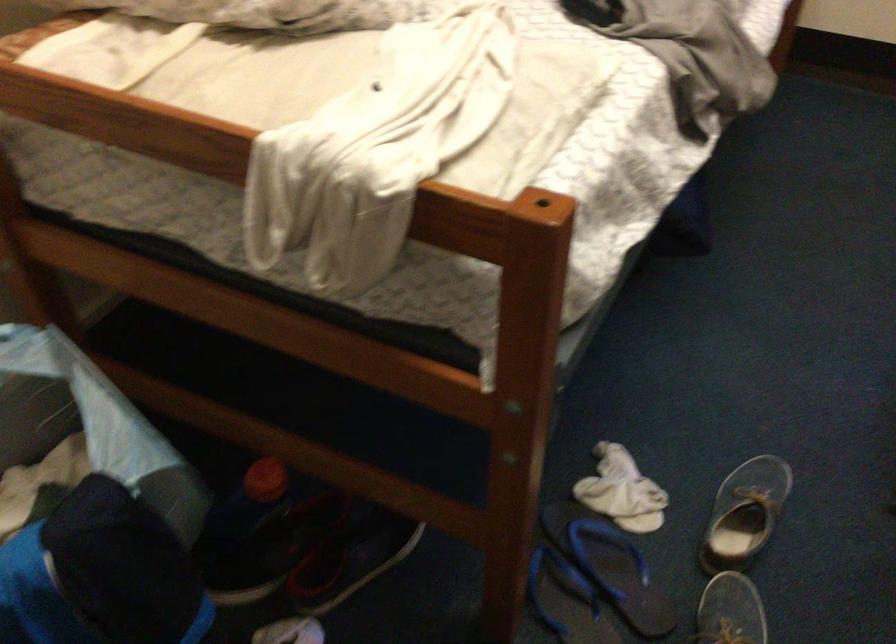
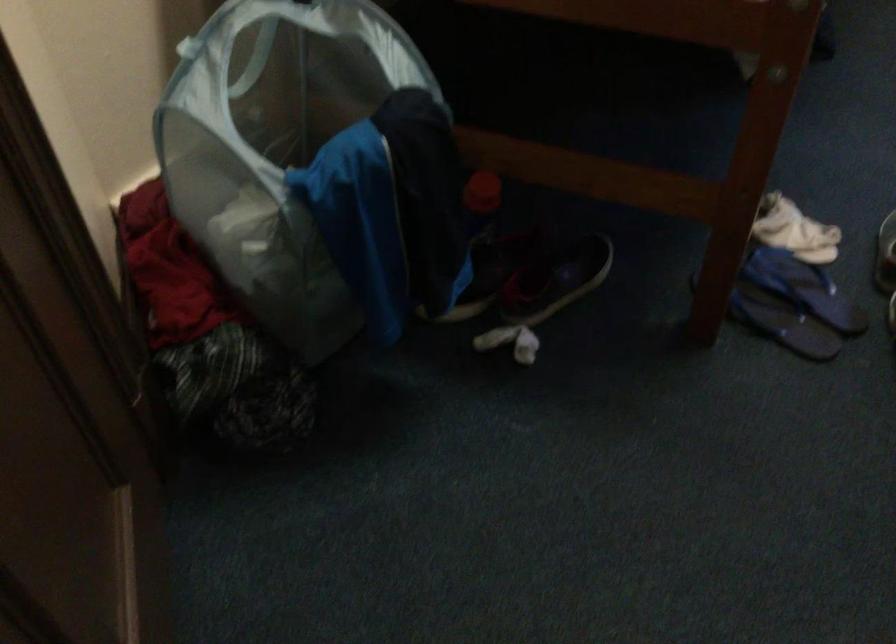
In the second image, find the point that corresponds to the point at 616,570 in the first image.

(804, 288)